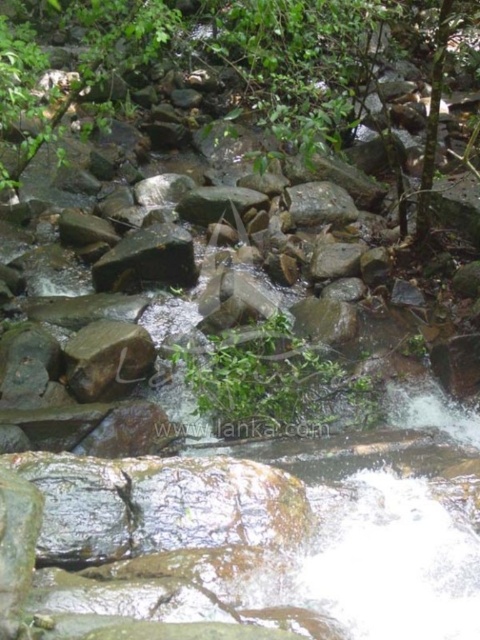
Between green leafy tree at center and green mossy rock at center, which one appears on the left side from the viewer's perspective?

green leafy tree at center

Is point (435, 144) positioned before point (335, 196)?

Yes.

Identify the location of green leafy tree at center. This screenshot has width=480, height=640. (302, 60).

Does green leafy tree at center appear on the right side of green rough stone at center?

Indeed, green leafy tree at center is positioned on the right side of green rough stone at center.

Between green leafy tree at center and green rough stone at center, which one is positioned higher?

Positioned higher is green leafy tree at center.

Does point (300, 141) come farther from viewer compared to point (152, 252)?

No, it is in front of (152, 252).

Locate an element on the screen. green leafy tree at center is located at coordinates click(302, 60).

Between point (139, 252) and point (346, 205), which one is positioned behind?

Point (346, 205)

Is green rough stone at center thinner than green mossy rock at center?

In fact, green rough stone at center might be wider than green mossy rock at center.

Where is `green rough stone at center`? The width and height of the screenshot is (480, 640). green rough stone at center is located at coordinates (146, 260).

Locate an element on the screen. This screenshot has height=640, width=480. green rough stone at center is located at coordinates (146, 260).